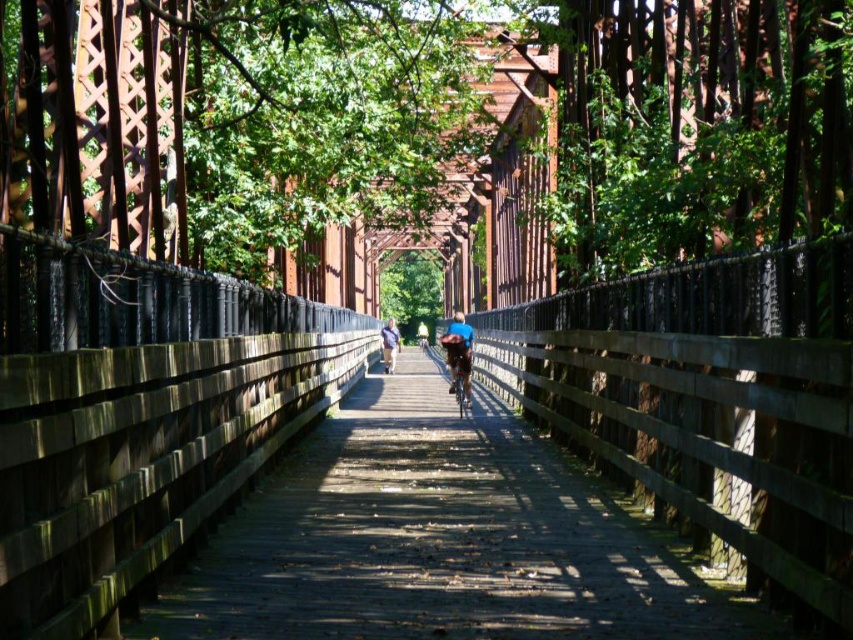
Question: Which object is the closest to the yellow fabric at center?

Choices:
 (A) shiny metallic bicycle at center
 (B) blue denim jacket at center
 (C) wooden planks at center

Answer: (B)

Question: Is the position of wooden planks at center more distant than that of shiny metallic bicycle at center?

Choices:
 (A) yes
 (B) no

Answer: (B)

Question: Which of the following is the closest to the observer?

Choices:
 (A) blue denim jacket at center
 (B) shiny metallic bicycle at center

Answer: (B)

Question: Can you confirm if shiny metallic bicycle at center is smaller than blue denim jacket at center?

Choices:
 (A) no
 (B) yes

Answer: (B)

Question: Can you confirm if wooden planks at center is bigger than yellow fabric at center?

Choices:
 (A) no
 (B) yes

Answer: (A)

Question: Which point appears closest to the camera in this image?

Choices:
 (A) (380, 333)
 (B) (450, 358)

Answer: (B)